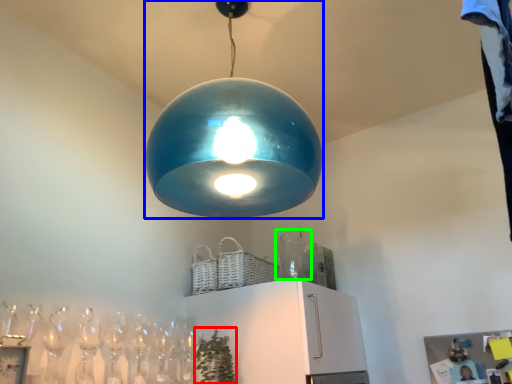
Question: Based on their relative distances, which object is nearer to plant (highlighted by a red box)? Choose from lamp (highlighted by a blue box) and glass vase (highlighted by a green box).

Choices:
 (A) lamp
 (B) glass vase

Answer: (B)